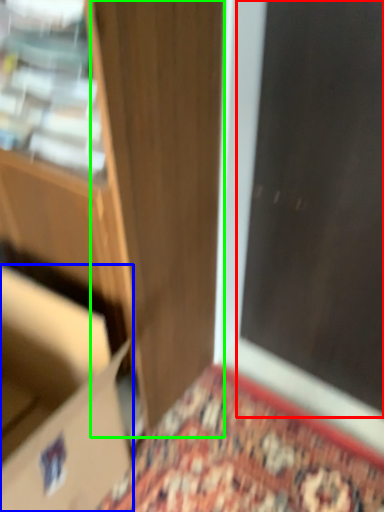
Question: Based on their relative distances, which object is farther from screen door (highlighted by a red box)? Choose from cardboard box (highlighted by a blue box) and door (highlighted by a green box).

Choices:
 (A) cardboard box
 (B) door

Answer: (A)